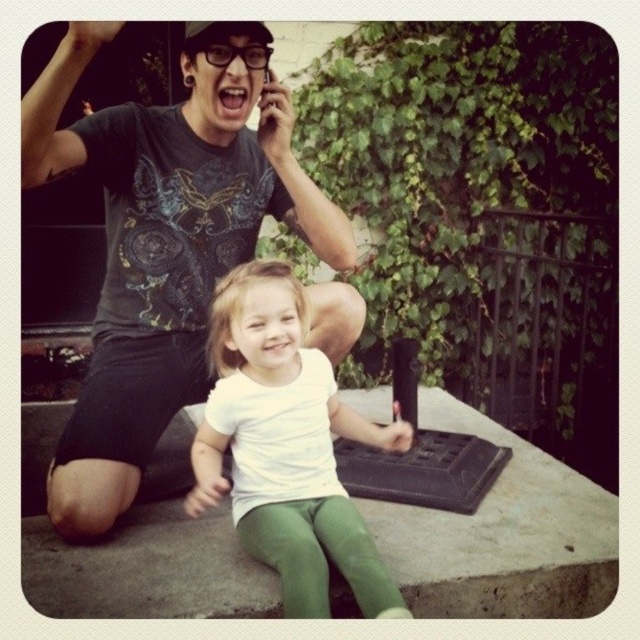
Question: Does matte black t-shirt at upper left appear under green fabric at lower center?

Choices:
 (A) yes
 (B) no

Answer: (B)

Question: Does green fabric at lower center appear over white matte shirt at center?

Choices:
 (A) yes
 (B) no

Answer: (B)

Question: Which object is closer to the camera taking this photo?

Choices:
 (A) green fabric at lower center
 (B) matte black t-shirt at upper left

Answer: (B)

Question: Can you confirm if green fabric at lower center is wider than white matte shirt at center?

Choices:
 (A) no
 (B) yes

Answer: (B)

Question: Which point is closer to the camera?

Choices:
 (A) (52, 150)
 (B) (145, 556)

Answer: (A)

Question: Which point appears farthest from the camera in this image?

Choices:
 (A) (195, 440)
 (B) (125, 580)

Answer: (A)